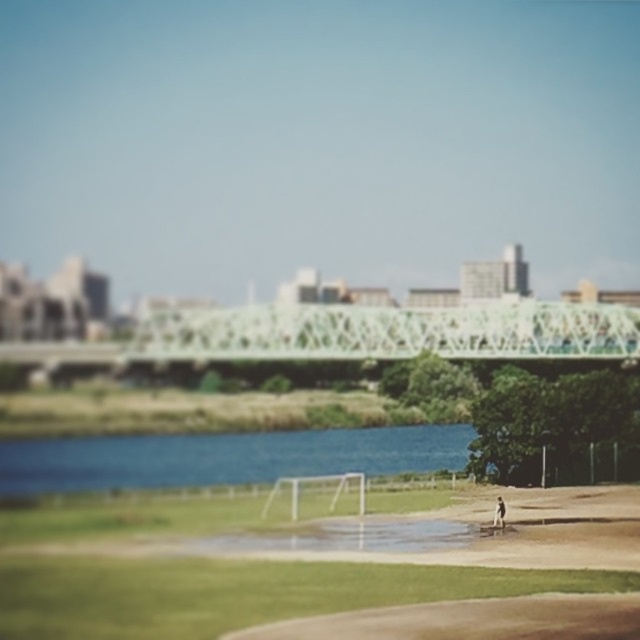
Question: Among these points, which one is farthest from the camera?

Choices:
 (A) (136, 476)
 (B) (493, 516)
 (C) (369, 611)

Answer: (A)

Question: Which point appears farthest from the camera in this image?

Choices:
 (A) (500, 508)
 (B) (282, 625)

Answer: (A)

Question: Where is blue water at center located in relation to brown dirt track at lower center in the image?

Choices:
 (A) below
 (B) above

Answer: (A)

Question: Which of the following is the farthest from the observer?

Choices:
 (A) brown dirt track at lower center
 (B) blue water at center
 (C) dark brown leather jacket at lower right

Answer: (B)

Question: Does blue water at center have a smaller size compared to dark brown leather jacket at lower right?

Choices:
 (A) yes
 (B) no

Answer: (B)

Question: Can you confirm if brown dirt track at lower center is thinner than dark brown leather jacket at lower right?

Choices:
 (A) no
 (B) yes

Answer: (A)